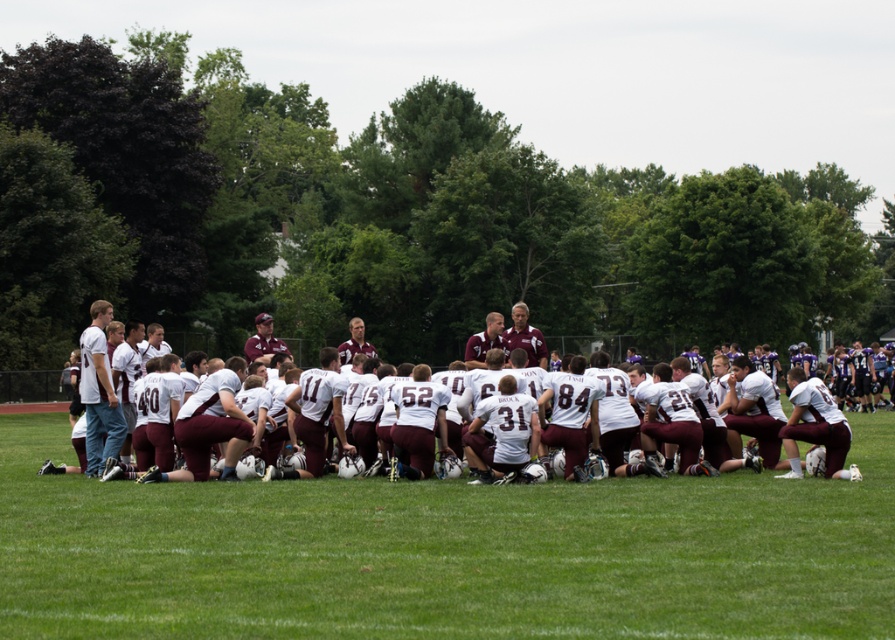
Question: Which object is farther from the camera taking this photo?

Choices:
 (A) white fabric field at center
 (B) white matte jersey at center

Answer: (B)

Question: Which of the following is the closest to the observer?

Choices:
 (A) white matte jersey at center
 (B) white fabric field at center

Answer: (B)

Question: Does white fabric field at center have a larger size compared to white matte jersey at center?

Choices:
 (A) no
 (B) yes

Answer: (A)

Question: Where is white fabric field at center located in relation to white matte jersey at center in the image?

Choices:
 (A) above
 (B) below

Answer: (B)

Question: Does white fabric field at center appear on the right side of white matte jersey at center?

Choices:
 (A) no
 (B) yes

Answer: (B)